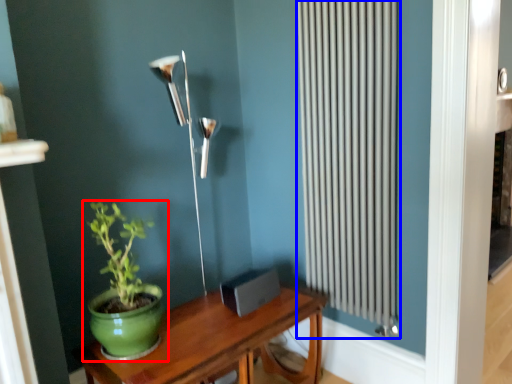
Question: Which object appears closest to the camera in this image, houseplant (highlighted by a red box) or radiator (highlighted by a blue box)?

Choices:
 (A) houseplant
 (B) radiator

Answer: (A)